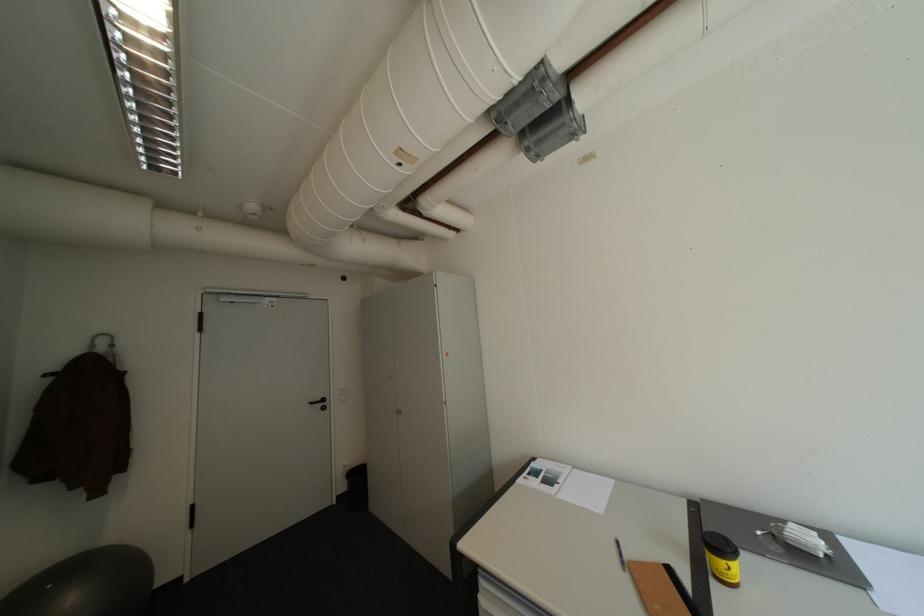
What do you see at coordinates (320, 403) in the screenshot? This screenshot has height=616, width=924. I see `a black door handle` at bounding box center [320, 403].